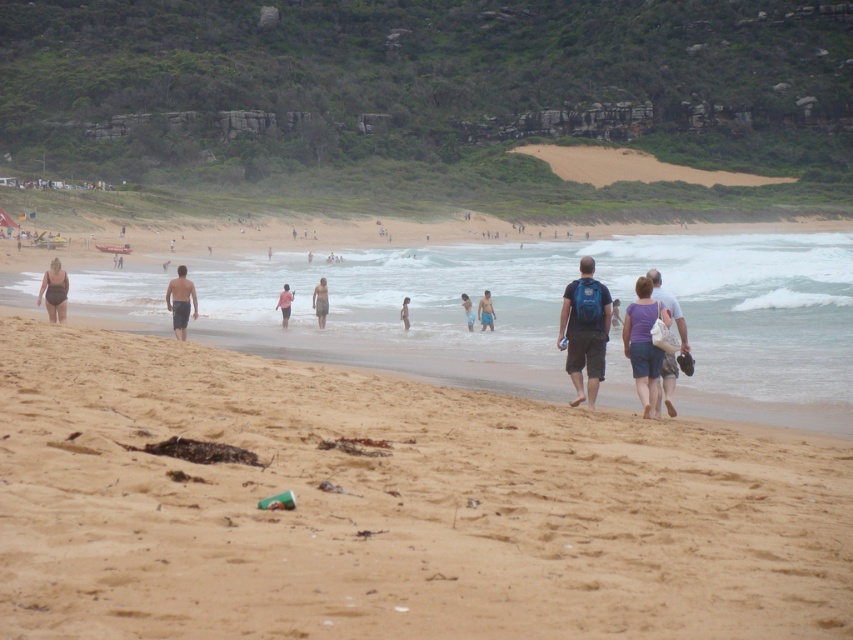
Question: Which point is farther to the camera?

Choices:
 (A) tan skin at center
 (B) purple fabric bag at center
 (C) blue fabric shorts at center

Answer: (C)

Question: Based on their relative distances, which object is farther from the light blue fabric swimsuit at center?

Choices:
 (A) tan skin at center
 (B) brown sandy beach at lower left
 (C) blue fabric shorts at center

Answer: (B)

Question: Is blue backpack at center behind matte black swimsuit at left?

Choices:
 (A) no
 (B) yes

Answer: (A)

Question: Is brown sandy beach at lower left positioned at the back of clear water at beach center?

Choices:
 (A) yes
 (B) no

Answer: (B)

Question: In this image, where is brown sandy beach at lower left located relative to light blue shorts at center?

Choices:
 (A) above
 (B) below

Answer: (B)

Question: Which of the following is the closest to the observer?

Choices:
 (A) matte black swimsuit at left
 (B) blue backpack at center

Answer: (B)